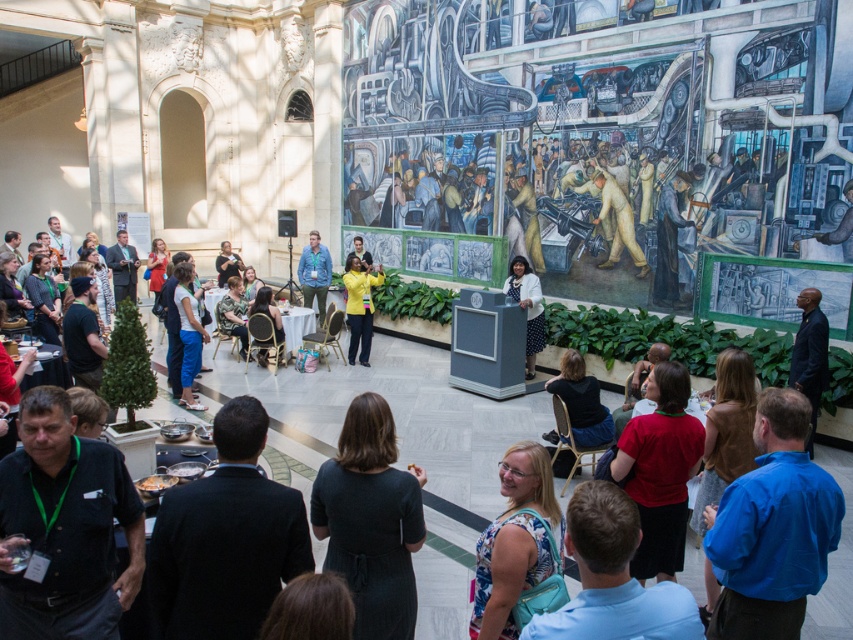
Is matte yellow jacket at center further to camera compared to denim jacket at center?

That is False.

Who is shorter, matte yellow jacket at center or denim jacket at center?

denim jacket at center

Which is in front, point (347, 296) or point (306, 291)?

Point (347, 296)

I want to click on matte yellow jacket at center, so click(358, 305).

What do you see at coordinates (370, 520) in the screenshot? Image resolution: width=853 pixels, height=640 pixels. I see `dark gray dress at center` at bounding box center [370, 520].

Can you confirm if dark gray dress at center is shorter than matte yellow jacket at center?

Yes.

Find the location of `dark gray dress at center`. dark gray dress at center is located at coordinates (370, 520).

Does floral dress at center have a lesser width compared to matte yellow jacket at center?

Correct, floral dress at center's width is less than matte yellow jacket at center's.

This screenshot has height=640, width=853. What do you see at coordinates (515, 541) in the screenshot?
I see `floral dress at center` at bounding box center [515, 541].

I want to click on floral dress at center, so click(x=515, y=541).

Image resolution: width=853 pixels, height=640 pixels. I want to click on floral dress at center, so click(x=515, y=541).